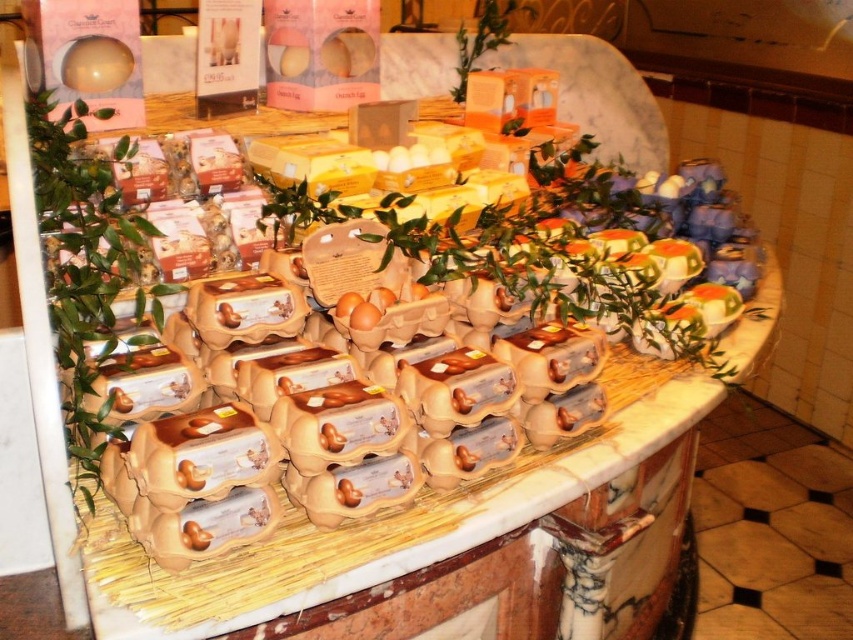
You are standing at the center of the countertop and see the point marked as point [85,266]. What object is located at that point?

The point [85,266] corresponds to the green leafy plant at left.

You are arranging flowers in a store and need to place a new bouquet between the green leafy plant at left and the green leafy plant at upper center. Which plant should you position the bouquet closer to to ensure it is nearer to the customer standing in front of the display?

You should position the bouquet closer to the green leafy plant at left because it is nearer to the customer, so placing the bouquet there ensures it is closer to the customer.

You are standing at a distance of 4 feet from the point labeled as point (78, 180). Can you reach it without moving closer?

The distance between you and point (78, 180) is 3.87 feet, which is slightly less than 4 feet. Therefore, you can reach it without moving closer.